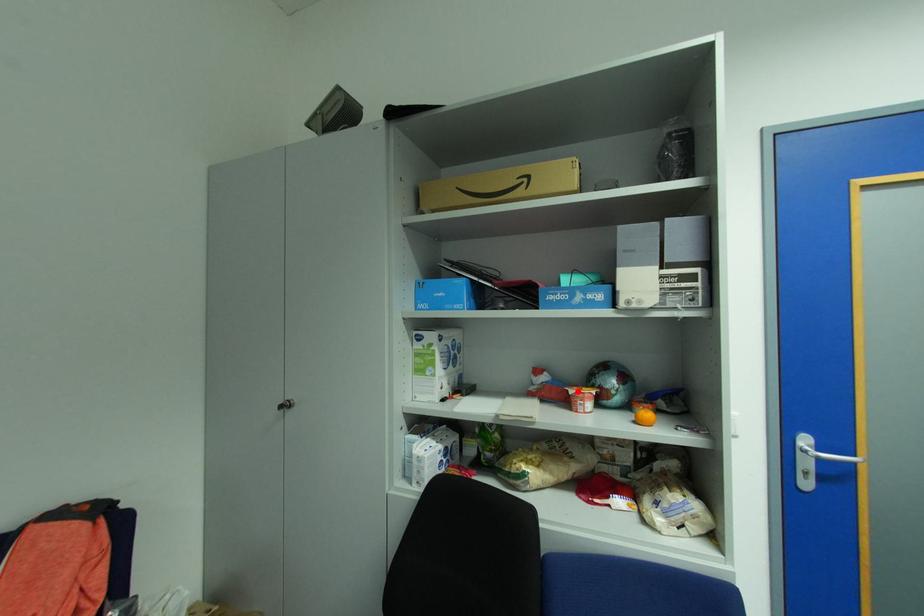
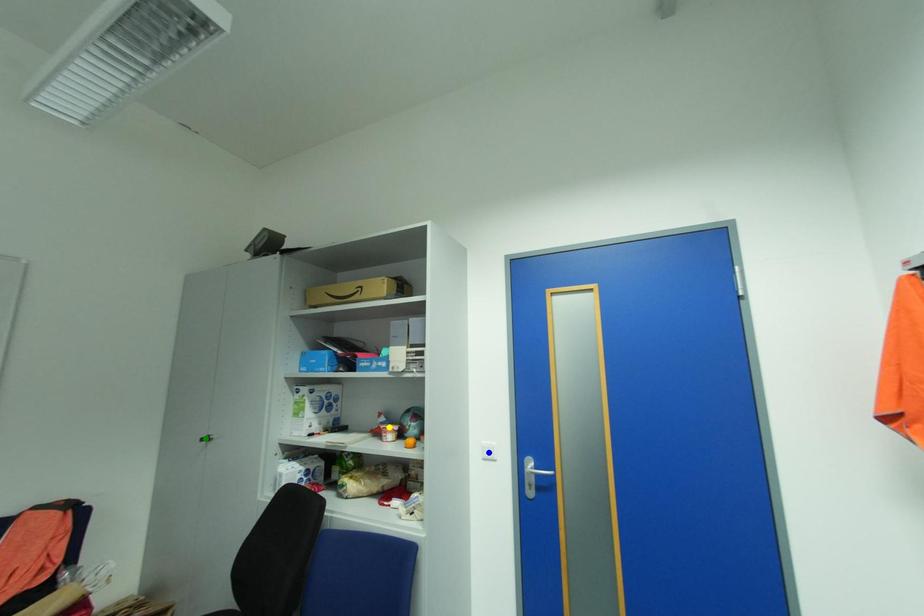
Question: I am providing you with two images of the same scene from different viewpoints. A red point is marked on the first image. You are given multiple points on the second image. Which point in image 2 represents the same 3d spot as the red point in image 1?

Choices:
 (A) yellow point
 (B) blue point
 (C) green point

Answer: (A)